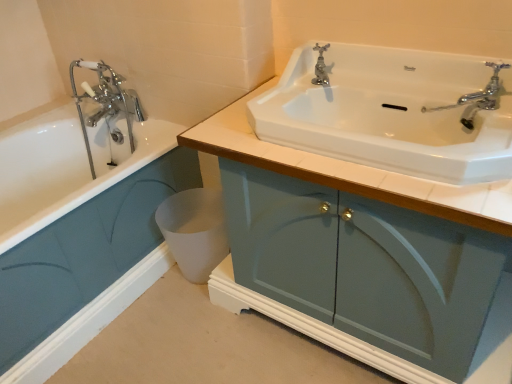
This screenshot has width=512, height=384. In order to click on free space to the right of polished chrome faucet at upper center in this screenshot , I will do `click(365, 95)`.